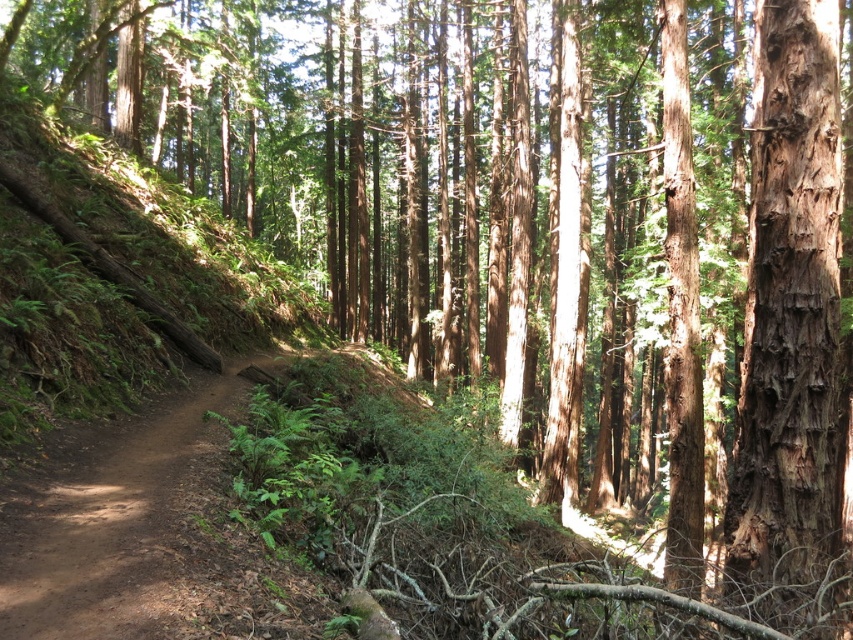
Is rough bark tree trunk at right above brown dirt track at center?

Indeed, rough bark tree trunk at right is positioned over brown dirt track at center.

Is point (792, 104) positioned in front of point (123, 449)?

Yes, point (792, 104) is in front of point (123, 449).

Is point (759, 524) farther from camera compared to point (19, 570)?

That is True.

Find the location of a particular element. rough bark tree trunk at right is located at coordinates (790, 320).